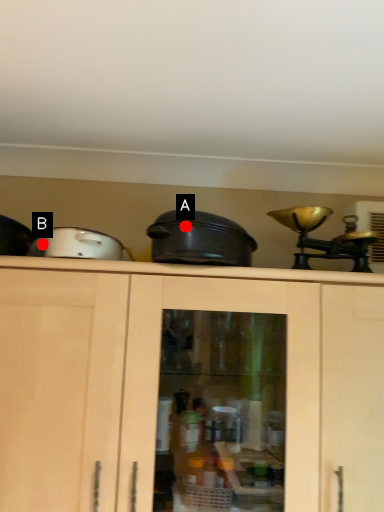
Question: Two points are circled on the image, labeled by A and B beside each circle. Which point is closer to the camera?

Choices:
 (A) A is closer
 (B) B is closer

Answer: (A)